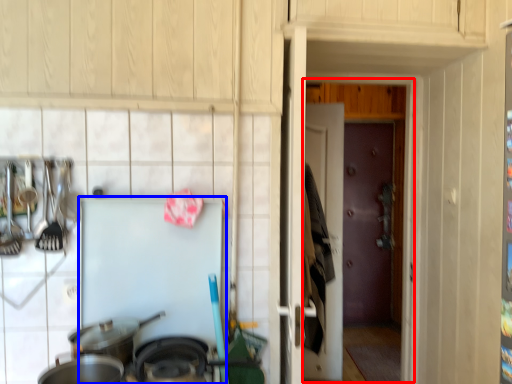
Question: Which point is further to the camera, glass door (highlighted by a red box) or appliance (highlighted by a blue box)?

Choices:
 (A) glass door
 (B) appliance

Answer: (A)